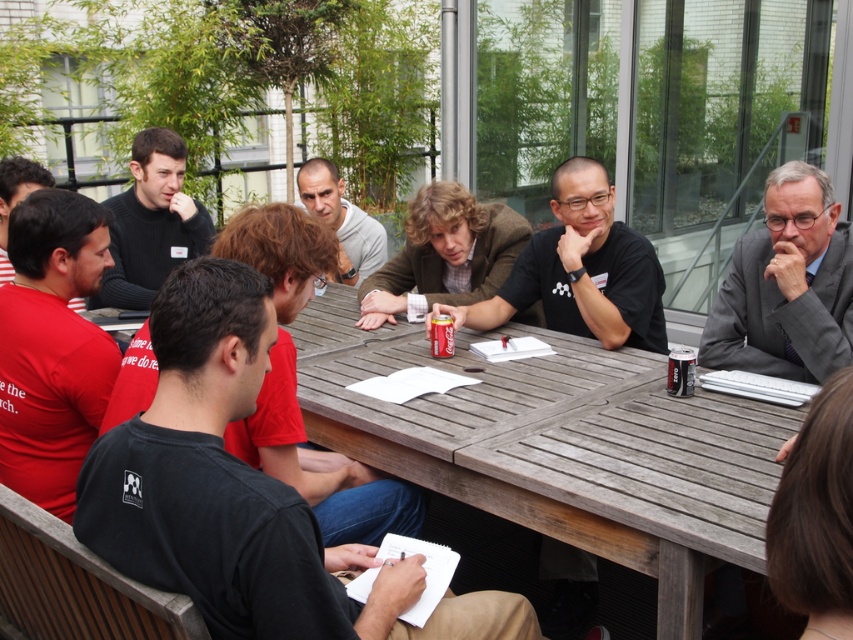
Is black t-shirt at center bigger than black matte shirt at center?

Correct, black t-shirt at center is larger in size than black matte shirt at center.

Can you confirm if black t-shirt at center is positioned to the left of black matte shirt at center?

Yes, black t-shirt at center is to the left of black matte shirt at center.

This screenshot has height=640, width=853. Identify the location of black t-shirt at center. (241, 493).

Is point (107, 220) behind point (352, 218)?

No.

Describe the element at coordinates (51, 346) in the screenshot. I see `matte red shirt at left` at that location.

Is point (9, 477) behind point (296, 179)?

No, (9, 477) is closer to viewer.

You are a GUI agent. You are given a task and a screenshot of the screen. Output one action in this format:
    pyautogui.click(x=<x>, y=<y>)
    Task: Click on the matte red shirt at left
    
    Given the screenshot: What is the action you would take?
    pyautogui.click(x=51, y=346)

Can you confirm if black t-shirt at center is positioned above gray suit at upper right?

No, black t-shirt at center is not above gray suit at upper right.

Between point (216, 596) and point (821, 278), which one is positioned in front?

Point (216, 596) is in front.

At what (x,y) coordinates should I click in order to perform the action: click on black t-shirt at center. Please return your answer as a coordinate pair (x, y). This screenshot has width=853, height=640. Looking at the image, I should click on (241, 493).